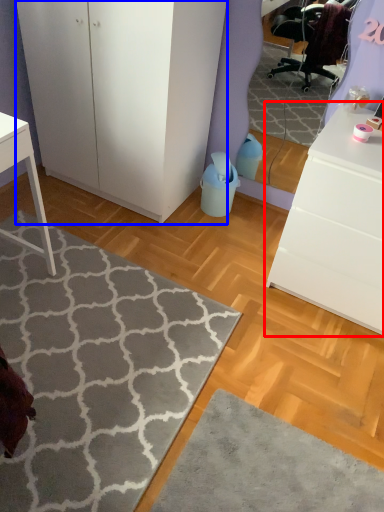
Question: Which object is closer to the camera taking this photo, chest of drawers (highlighted by a red box) or cabinetry (highlighted by a blue box)?

Choices:
 (A) chest of drawers
 (B) cabinetry

Answer: (A)